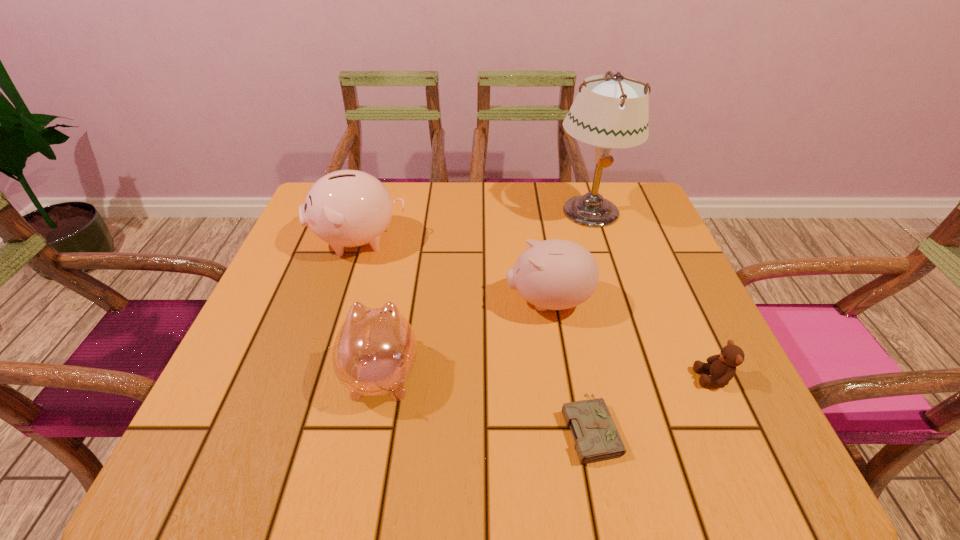
Find the location of `free space located 0.150m at the snout of the rightmost piggy bank`. free space located 0.150m at the snout of the rightmost piggy bank is located at coordinates (434, 301).

At what (x,y) coordinates should I click in order to perform the action: click on free spot located 0.240m at the snout of the rightmost piggy bank. Please return your answer as a coordinate pair (x, y). The width and height of the screenshot is (960, 540). Looking at the image, I should click on (392, 301).

Identify the location of free space located at the snout of the rightmost piggy bank. This screenshot has width=960, height=540. (345, 301).

The image size is (960, 540). Identify the location of vacant space located on the front facing side of the nearest piggy bank. (407, 245).

This screenshot has height=540, width=960. Find the location of `vacant space situated on the front facing side of the nearest piggy bank`. vacant space situated on the front facing side of the nearest piggy bank is located at coordinates (410, 228).

This screenshot has height=540, width=960. I want to click on vacant position located 0.400m on the front facing side of the nearest piggy bank, so click(412, 219).

This screenshot has width=960, height=540. What are the coordinates of `free space located 0.180m on the face of the second shortest object` in the screenshot? It's located at click(x=596, y=377).

Identify the location of free spot located on the face of the second shortest object. The image size is (960, 540). (479, 377).

I want to click on free spot located on the face of the second shortest object, so (662, 377).

Locate an element on the screen. The width and height of the screenshot is (960, 540). vacant area situated 0.370m on the back of the shortest object is located at coordinates (557, 257).